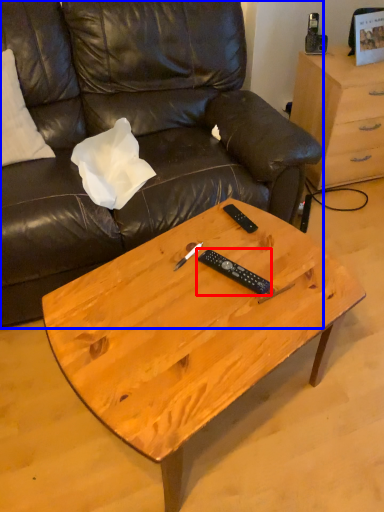
Question: Which object is closer to the camera taking this photo, remote (highlighted by a red box) or studio couch (highlighted by a blue box)?

Choices:
 (A) remote
 (B) studio couch

Answer: (B)